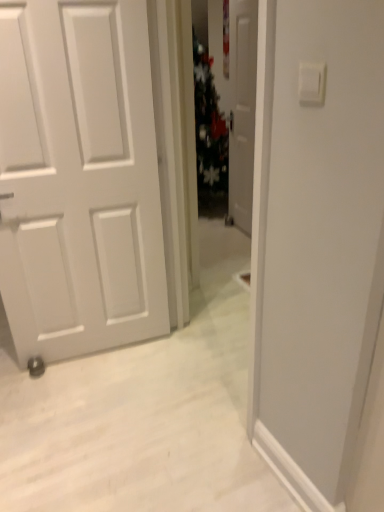
Question: Are white glossy door at center and white plastic light switch at upper right far apart?

Choices:
 (A) no
 (B) yes

Answer: (B)

Question: Can you confirm if white glossy door at center is taller than white plastic light switch at upper right?

Choices:
 (A) yes
 (B) no

Answer: (A)

Question: From a real-world perspective, is white glossy door at center below white plastic light switch at upper right?

Choices:
 (A) yes
 (B) no

Answer: (A)

Question: Is white glossy door at center facing towards white plastic light switch at upper right?

Choices:
 (A) yes
 (B) no

Answer: (B)

Question: Can you confirm if white glossy door at center is thinner than white plastic light switch at upper right?

Choices:
 (A) yes
 (B) no

Answer: (B)

Question: Is white glossy door at center in contact with white plastic light switch at upper right?

Choices:
 (A) yes
 (B) no

Answer: (B)

Question: Does white plastic light switch at upper right have a greater height compared to white glossy door at center?

Choices:
 (A) no
 (B) yes

Answer: (A)

Question: Is white plastic light switch at upper right closer to the viewer compared to white glossy door at center?

Choices:
 (A) no
 (B) yes

Answer: (B)

Question: From the image's perspective, is white plastic light switch at upper right below white glossy door at center?

Choices:
 (A) yes
 (B) no

Answer: (A)

Question: Is white plastic light switch at upper right positioned behind white glossy door at center?

Choices:
 (A) no
 (B) yes

Answer: (A)

Question: From a real-world perspective, is white plastic light switch at upper right located higher than white glossy door at center?

Choices:
 (A) yes
 (B) no

Answer: (A)

Question: Considering the relative sizes of white plastic light switch at upper right and white glossy door at center in the image provided, is white plastic light switch at upper right thinner than white glossy door at center?

Choices:
 (A) yes
 (B) no

Answer: (A)

Question: Looking at their shapes, would you say white plastic light switch at upper right is wider or thinner than white glossy door at center?

Choices:
 (A) wide
 (B) thin

Answer: (B)